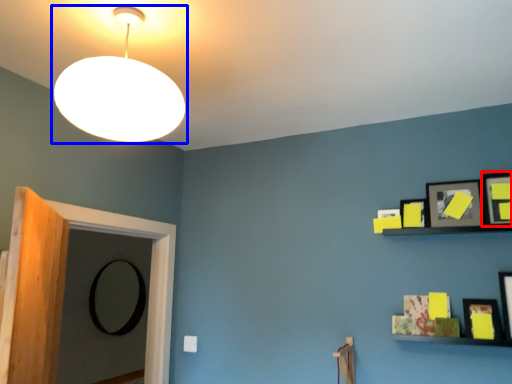
Question: Among these objects, which one is nearest to the camera, picture frame (highlighted by a red box) or lamp (highlighted by a blue box)?

Choices:
 (A) picture frame
 (B) lamp

Answer: (B)